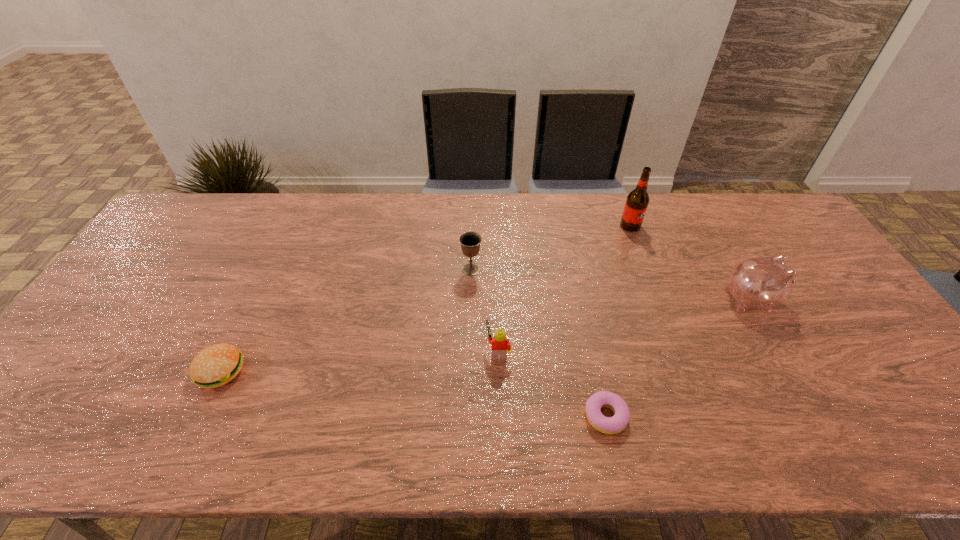
Point out which object is positioned as the third nearest to the fifth nearest object. Please provide its 2D coordinates. Your answer should be formatted as a tuple, i.e. [(x, y)], where the tuple contains the x and y coordinates of a point satisfying the conditions above.

[(637, 201)]

Find the location of a particular element. vacant area that satisfies the following two spatial constraints: 1. on the back side of the nearest object; 2. in front of the Lego with the accessory visible is located at coordinates (591, 350).